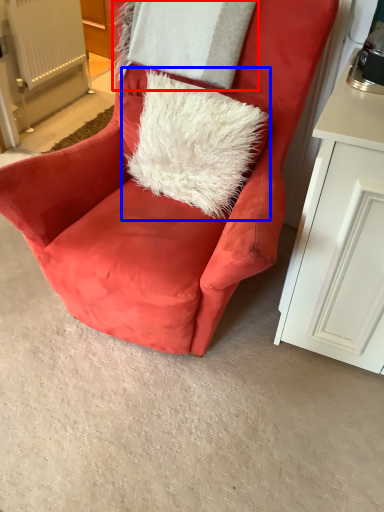
Question: Which object appears farthest to the camera in this image, pillow (highlighted by a red box) or throw pillow (highlighted by a blue box)?

Choices:
 (A) pillow
 (B) throw pillow

Answer: (A)